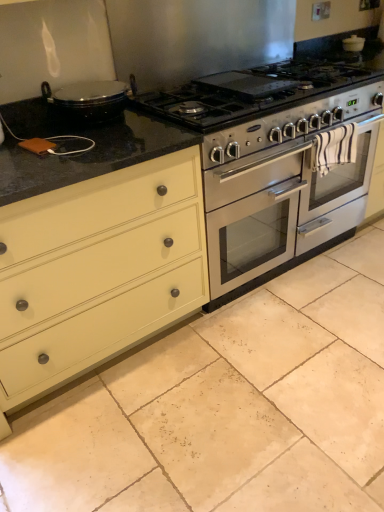
Question: From the image's perspective, is satin silver gas stove at center above or below beige matte tile at center?

Choices:
 (A) below
 (B) above

Answer: (B)

Question: Considering the positions of satin silver gas stove at center and beige matte tile at center in the image, is satin silver gas stove at center taller or shorter than beige matte tile at center?

Choices:
 (A) short
 (B) tall

Answer: (B)

Question: Which object is the closest to the matte cream drawer at left?

Choices:
 (A) satin silver gas stove at center
 (B) beige matte tile at center
 (C) stainless steel oven at center

Answer: (B)

Question: Which object is positioned farthest from the matte cream drawer at left?

Choices:
 (A) satin silver gas stove at center
 (B) stainless steel oven at center
 (C) beige matte tile at center

Answer: (A)